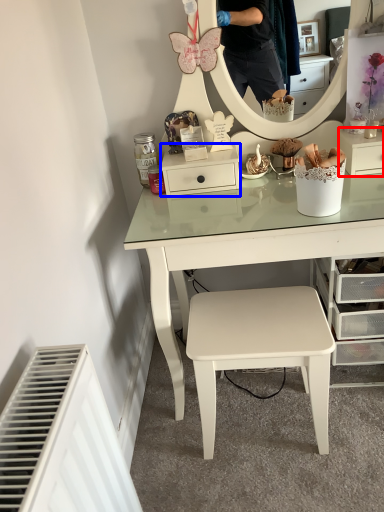
Question: Which object is closer to the camera taking this photo, shelf (highlighted by a red box) or shelf (highlighted by a blue box)?

Choices:
 (A) shelf
 (B) shelf

Answer: (A)